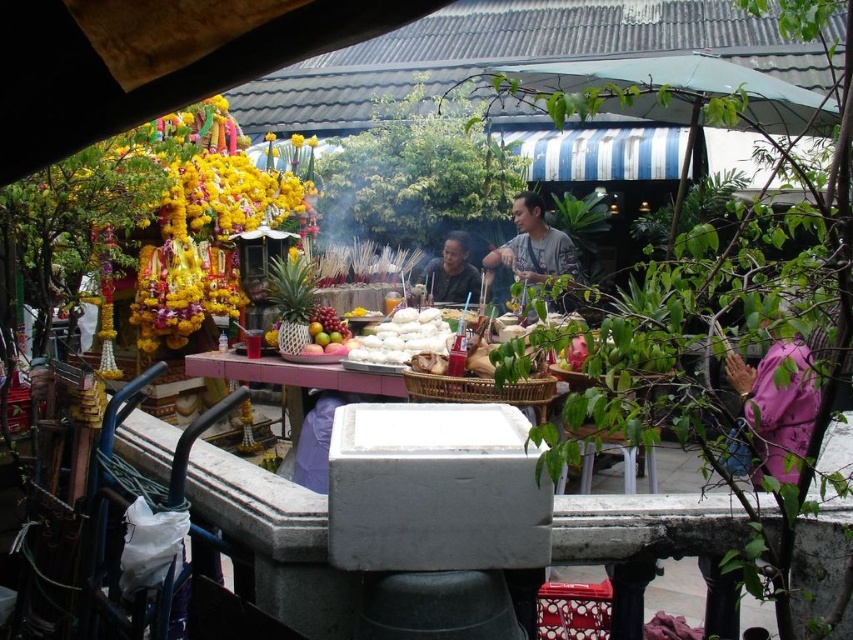
Question: Estimate the real-world distances between objects in this image. Which object is closer to the matte black shirt at center?

Choices:
 (A) white fluffy dumplings at center
 (B) pink fabric at right

Answer: (A)

Question: Does gray cotton shirt at center have a lesser width compared to white fluffy dumplings at center?

Choices:
 (A) yes
 (B) no

Answer: (B)

Question: Among these points, which one is farthest from the camera?

Choices:
 (A) (479, 289)
 (B) (763, 426)
 (C) (558, 268)

Answer: (A)

Question: Considering the relative positions of white fluffy dumplings at center and matte black shirt at center in the image provided, where is white fluffy dumplings at center located with respect to matte black shirt at center?

Choices:
 (A) left
 (B) right

Answer: (A)

Question: Can you confirm if white fluffy dumplings at center is thinner than matte black shirt at center?

Choices:
 (A) yes
 (B) no

Answer: (B)

Question: Which object is closer to the camera taking this photo?

Choices:
 (A) gray cotton shirt at center
 (B) matte black shirt at center

Answer: (A)